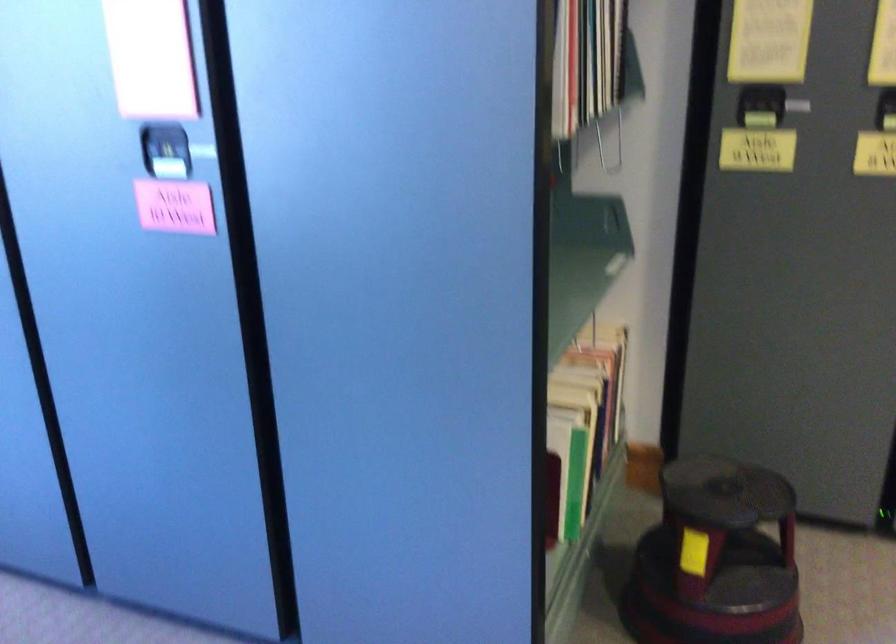
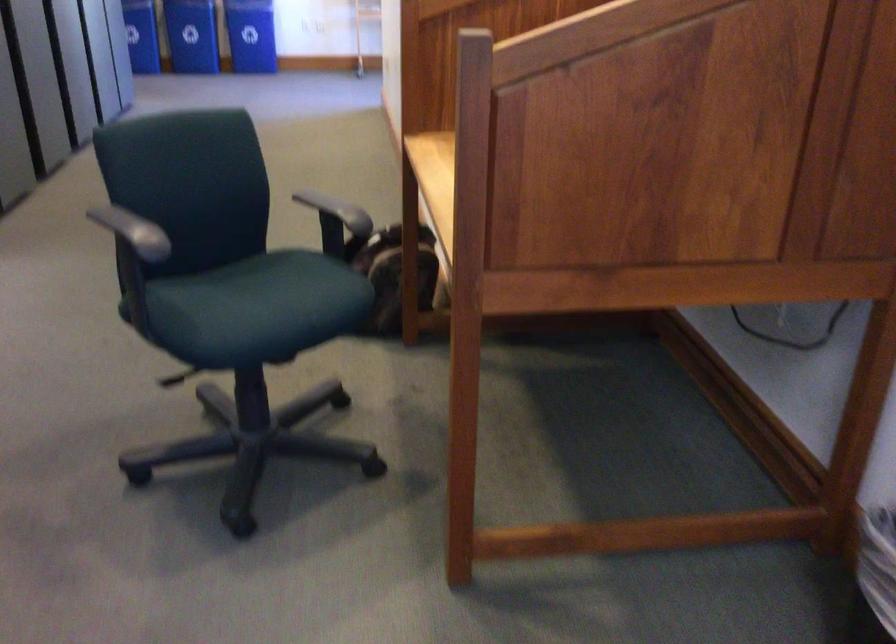
Based on the continuous images, in which direction is the camera rotating?

The camera rotated toward right-down.